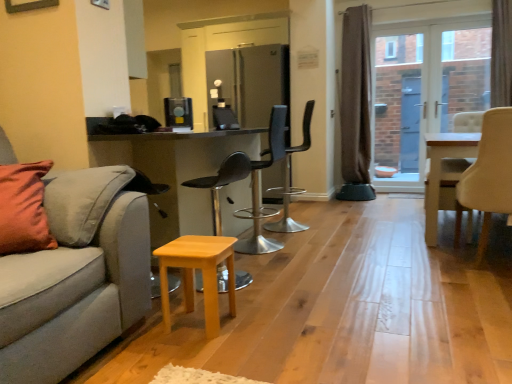
Question: Which direction should I rotate to look at satin silver coffee machine at center, which ranks as the 1th appliance in front-to-back order?

Choices:
 (A) right
 (B) left

Answer: (B)

Question: From the image's perspective, does wooden stool at center, which ranks as the first chair in left-to-right order, appear higher than satin silver coffee machine at center, the second appliance viewed from the right?

Choices:
 (A) yes
 (B) no

Answer: (B)

Question: Is wooden stool at center, which ranks as the first chair in left-to-right order, oriented away from satin silver coffee machine at center, which ranks as the 1th appliance in front-to-back order?

Choices:
 (A) no
 (B) yes

Answer: (A)

Question: Is wooden stool at center, which ranks as the first chair in left-to-right order, aimed at satin silver coffee machine at center, the 2th appliance when ordered from top to bottom?

Choices:
 (A) no
 (B) yes

Answer: (A)

Question: Is wooden stool at center, the 4th chair in the right-to-left sequence, next to satin silver coffee machine at center, the 2th appliance when ordered from top to bottom, and touching it?

Choices:
 (A) no
 (B) yes

Answer: (A)

Question: From the image's perspective, is wooden stool at center, which ranks as the first chair in left-to-right order, under satin silver coffee machine at center, the first appliance from the bottom?

Choices:
 (A) no
 (B) yes

Answer: (B)

Question: Is wooden stool at center, the 4th chair in the right-to-left sequence, to the right of satin silver coffee machine at center, the 1th appliance in the left-to-right sequence, from the viewer's perspective?

Choices:
 (A) no
 (B) yes

Answer: (B)

Question: Considering the relative positions of clear glass door at center and white wooden table at center in the image provided, is clear glass door at center in front of white wooden table at center?

Choices:
 (A) no
 (B) yes

Answer: (A)

Question: Does clear glass door at center lie behind white wooden table at center?

Choices:
 (A) no
 (B) yes

Answer: (B)

Question: Is clear glass door at center at the right side of white wooden table at center?

Choices:
 (A) no
 (B) yes

Answer: (B)

Question: Can you confirm if clear glass door at center is positioned to the left of white wooden table at center?

Choices:
 (A) yes
 (B) no

Answer: (B)

Question: Does clear glass door at center have a larger size compared to white wooden table at center?

Choices:
 (A) yes
 (B) no

Answer: (A)

Question: From a real-world perspective, does clear glass door at center stand above white wooden table at center?

Choices:
 (A) no
 (B) yes

Answer: (B)

Question: Is wooden stool at center, the 4th chair in the right-to-left sequence, positioned far away from white wooden table at center?

Choices:
 (A) yes
 (B) no

Answer: (A)